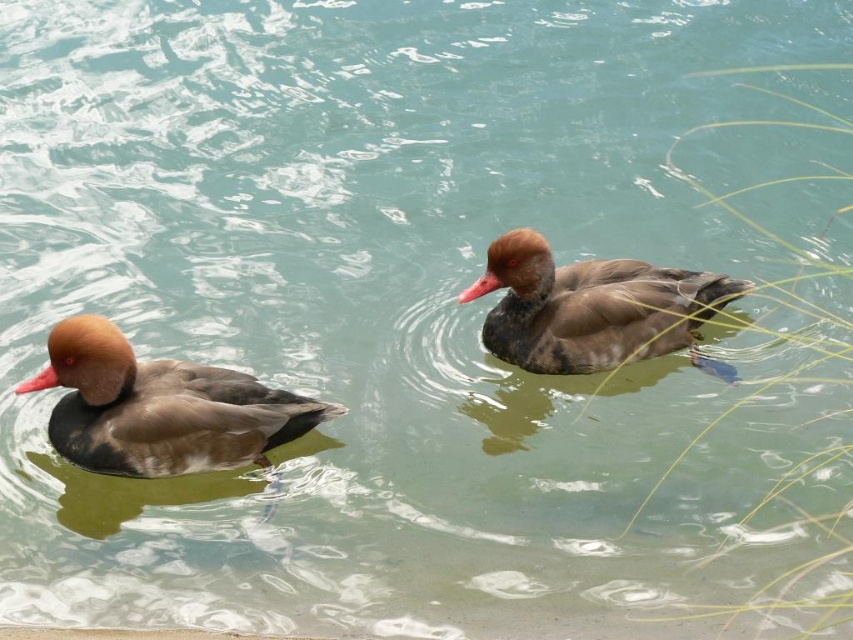
You are observing two ducks in a pond. The brown matte duck at left is swimming and the brown matte duck at center is floating. Which duck is positioned lower in the water compared to the other?

The brown matte duck at left is positioned lower in the water compared to the brown matte duck at center because it is below it.

You are a photographer trying to capture both ducks in a single shot. Given that the brown matte duck at left is smaller in your viewfinder compared to the brown matte duck at center, which duck is closer to you and why?

The brown matte duck at left is closer to you because objects that are closer appear larger in the viewfinder. Since the brown matte duck at left occupies less space, it means it is farther away, making the brown matte duck at center closer and larger.